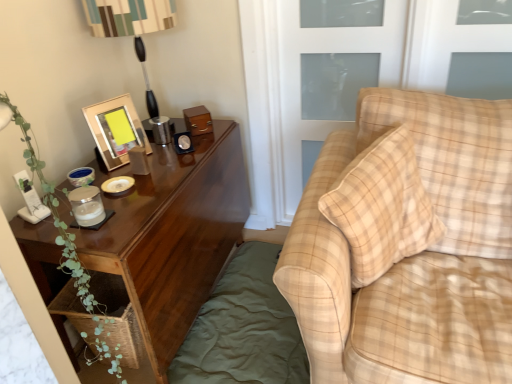
Where is `free space on the front side of wooden table lamp at upper left`? This screenshot has height=384, width=512. free space on the front side of wooden table lamp at upper left is located at coordinates (168, 155).